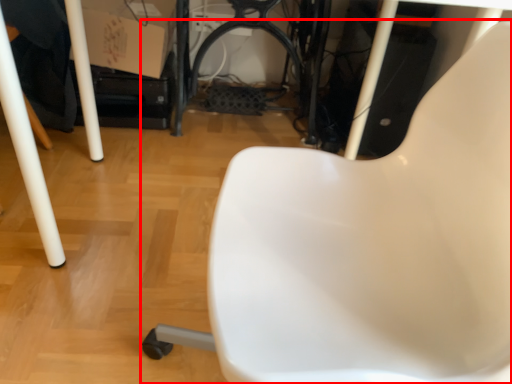
Question: In this image, where is chair (annotated by the red box) located relative to cardboard box?

Choices:
 (A) right
 (B) left

Answer: (A)